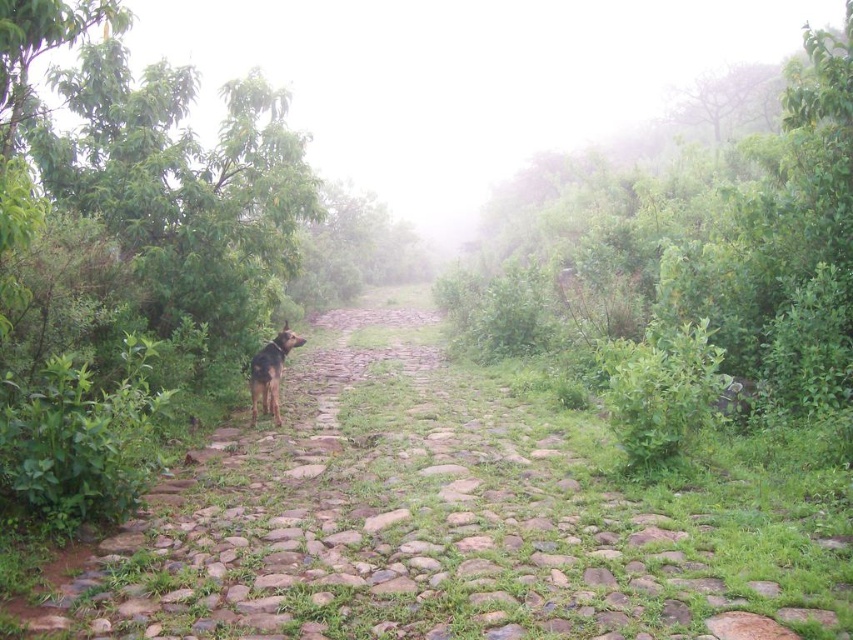
Between point (701, 525) and point (265, 410), which one is positioned in front?

Point (701, 525)

Consider the image. Does green grassy trail at center have a smaller size compared to brown fur dog at left?

No.

Which is behind, point (94, 570) or point (251, 392)?

Positioned behind is point (251, 392).

The width and height of the screenshot is (853, 640). Identify the location of green grassy trail at center. (x=445, y=522).